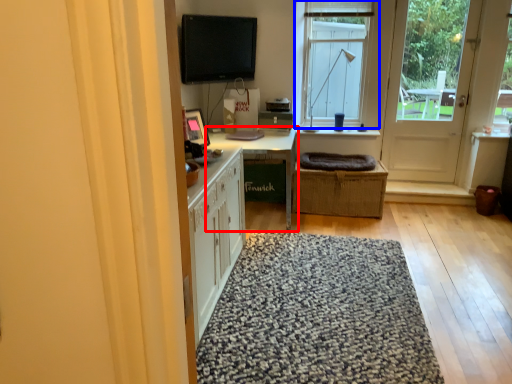
Question: Which object is further to the camera taking this photo, table (highlighted by a red box) or window (highlighted by a blue box)?

Choices:
 (A) table
 (B) window

Answer: (B)